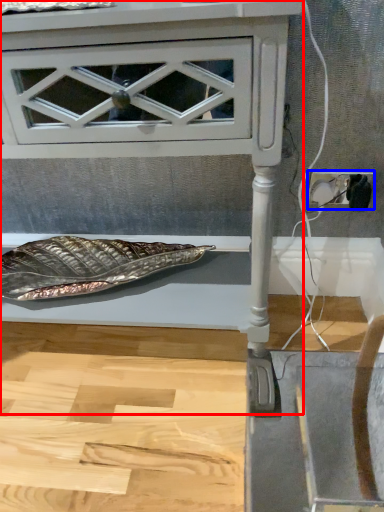
Question: Which object appears farthest to the camera in this image, furniture (highlighted by a red box) or electric outlet (highlighted by a blue box)?

Choices:
 (A) furniture
 (B) electric outlet

Answer: (B)